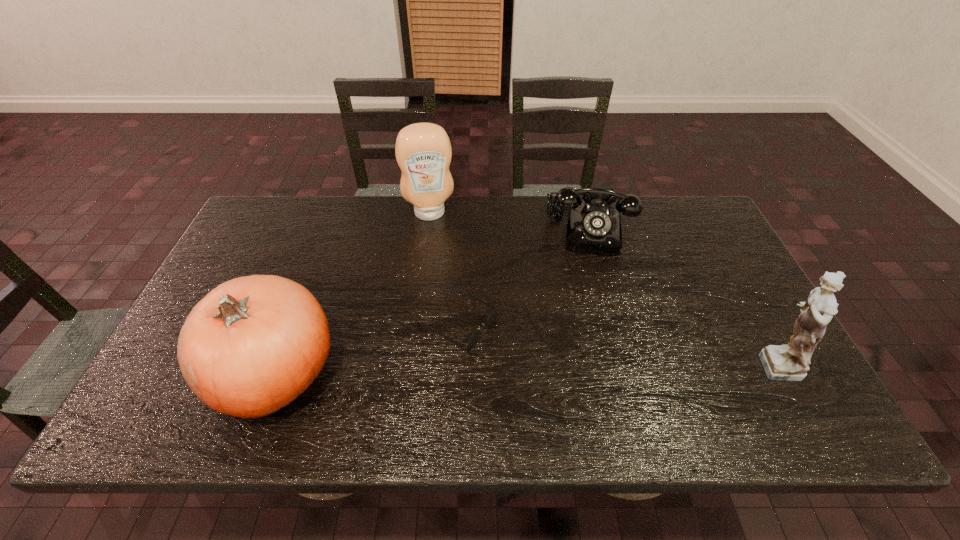
The width and height of the screenshot is (960, 540). What are the coordinates of `free space between the fourth object from left to right and the condiment` in the screenshot? It's located at (511, 221).

Locate an element on the screen. This screenshot has height=540, width=960. free area in between the figurine and the leftmost object is located at coordinates (523, 367).

What are the coordinates of `object that is the closest to the figurine` in the screenshot? It's located at (594, 227).

At what (x,y) coordinates should I click in order to perform the action: click on the closest object to the second shortest object. Please return your answer as a coordinate pair (x, y). This screenshot has width=960, height=540. Looking at the image, I should click on (472, 338).

Locate an element on the screen. free location that satisfies the following two spatial constraints: 1. on the back side of the second shortest object; 2. on the left side of the pumpkin is located at coordinates (328, 228).

The height and width of the screenshot is (540, 960). I want to click on free point that satisfies the following two spatial constraints: 1. on the back side of the pumpkin; 2. on the right side of the condiment, so click(x=334, y=213).